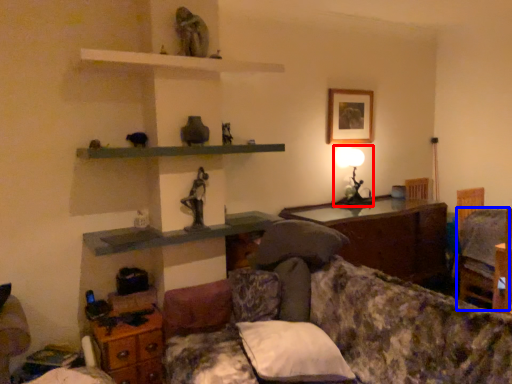
Question: Among these objects, which one is farthest to the camera, table lamp (highlighted by a red box) or swivel chair (highlighted by a blue box)?

Choices:
 (A) table lamp
 (B) swivel chair

Answer: (A)